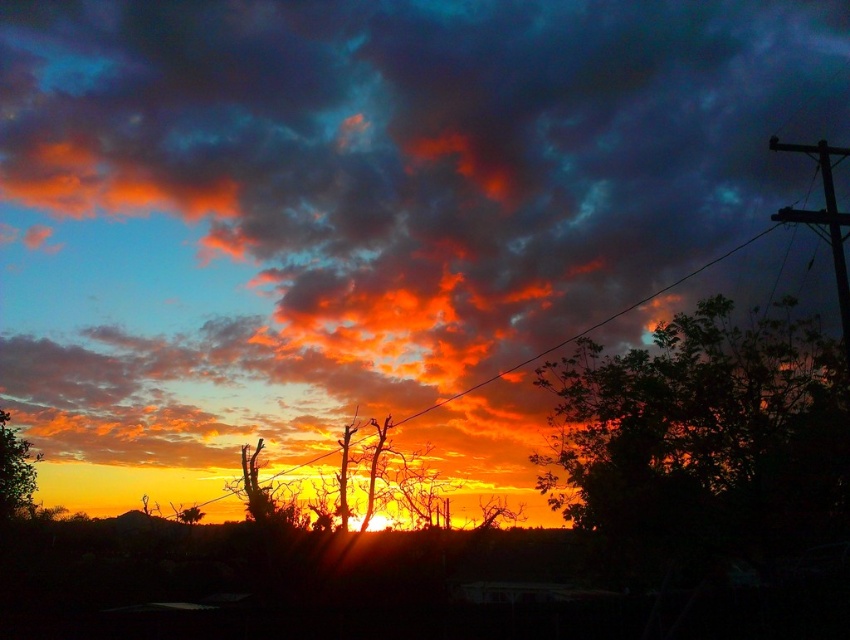
Can you confirm if dark green leafy tree at right is thinner than green matte tree at lower left?

In fact, dark green leafy tree at right might be wider than green matte tree at lower left.

Is point (672, 392) positioned behind point (14, 477)?

That is False.

Between point (722, 369) and point (10, 429), which one is positioned in front?

Point (722, 369) is in front.

You are a GUI agent. You are given a task and a screenshot of the screen. Output one action in this format:
    pyautogui.click(x=<x>, y=<y>)
    Task: Click on the dark green leafy tree at right
    
    Given the screenshot: What is the action you would take?
    pyautogui.click(x=701, y=440)

Who is shorter, dark green leafy tree at right or metallic wire at upper right?

With less height is metallic wire at upper right.

Can you confirm if dark green leafy tree at right is positioned to the right of metallic wire at upper right?

In fact, dark green leafy tree at right is to the left of metallic wire at upper right.

What do you see at coordinates (701, 440) in the screenshot? This screenshot has height=640, width=850. I see `dark green leafy tree at right` at bounding box center [701, 440].

Locate an element on the screen. The width and height of the screenshot is (850, 640). dark green leafy tree at right is located at coordinates [701, 440].

Does metallic wire at upper right have a larger size compared to green matte tree at lower left?

Indeed, metallic wire at upper right has a larger size compared to green matte tree at lower left.

Does metallic wire at upper right appear under green matte tree at lower left?

No.

Locate an element on the screen. This screenshot has height=640, width=850. metallic wire at upper right is located at coordinates (823, 218).

At what (x,y) coordinates should I click in order to perform the action: click on metallic wire at upper right. Please return your answer as a coordinate pair (x, y). Looking at the image, I should click on (823, 218).